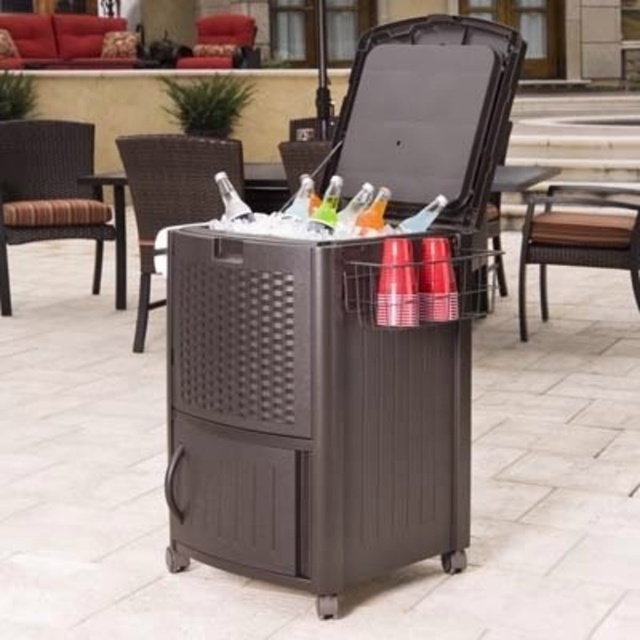
Question: In this image, where is brown wicker chair at upper left located relative to matte plastic chair at upper center?

Choices:
 (A) below
 (B) above

Answer: (A)

Question: Is brown wicker chair at left positioned in front of brown wicker chair at right?

Choices:
 (A) no
 (B) yes

Answer: (A)

Question: Which of the following is the farthest from the observer?

Choices:
 (A) brown wicker chair at upper left
 (B) brown plastic table at center

Answer: (A)

Question: Among these objects, which one is nearest to the camera?

Choices:
 (A) matte plastic chair at upper center
 (B) brown wicker chair at right
 (C) brown wicker chair at upper left
 (D) brown wicker chair at left

Answer: (A)

Question: Which is farther from the brown wicker chair at upper left?

Choices:
 (A) matte plastic chair at upper center
 (B) brown wicker chair at left

Answer: (B)

Question: Is brown wicker chair at left further to the viewer compared to brown wicker chair at upper left?

Choices:
 (A) yes
 (B) no

Answer: (A)